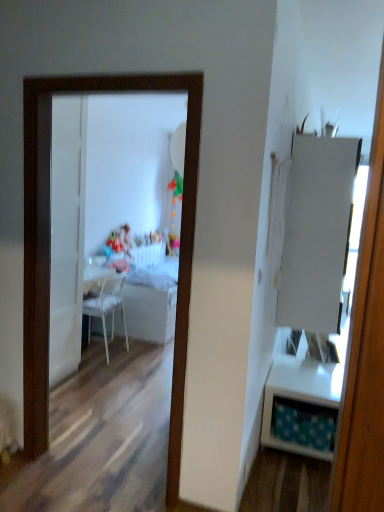
I want to click on free region under white glossy mirror at center (from a real-world perspective), so click(x=89, y=476).